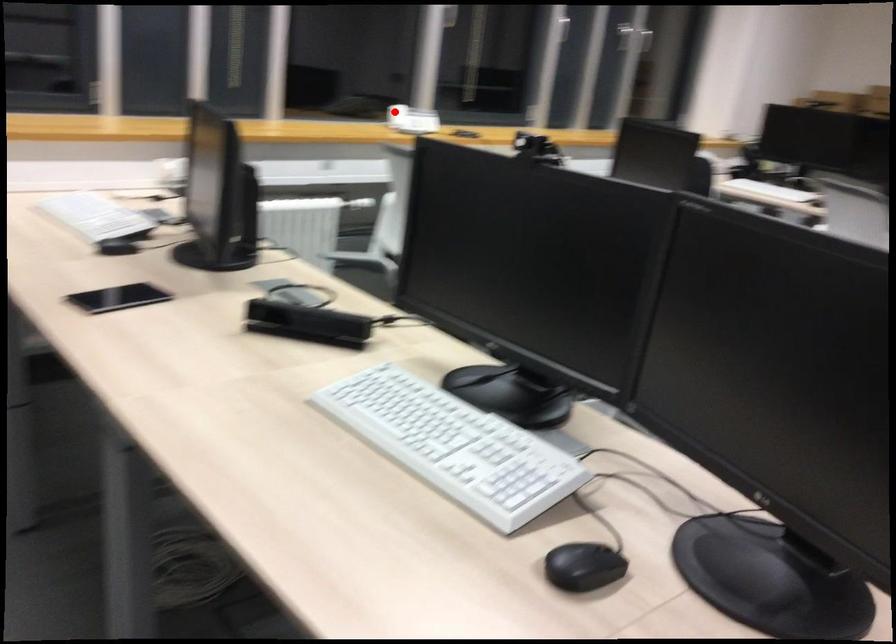
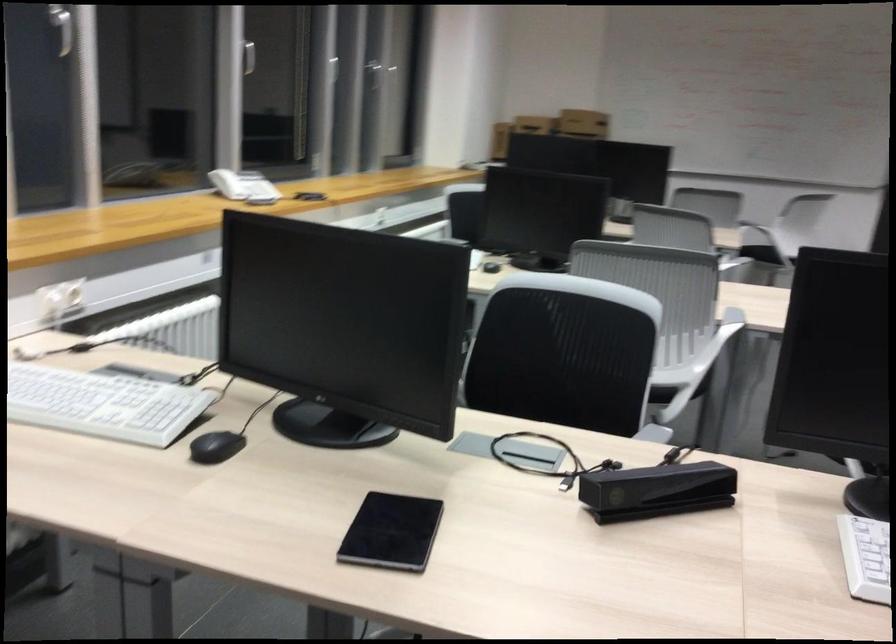
Question: I am providing you with two images of the same scene from different viewpoints. A red point is shown in image1. For the corresponding object point in image2, is it positioned nearer or farther from the camera?

Choices:
 (A) Nearer
 (B) Farther

Answer: (A)